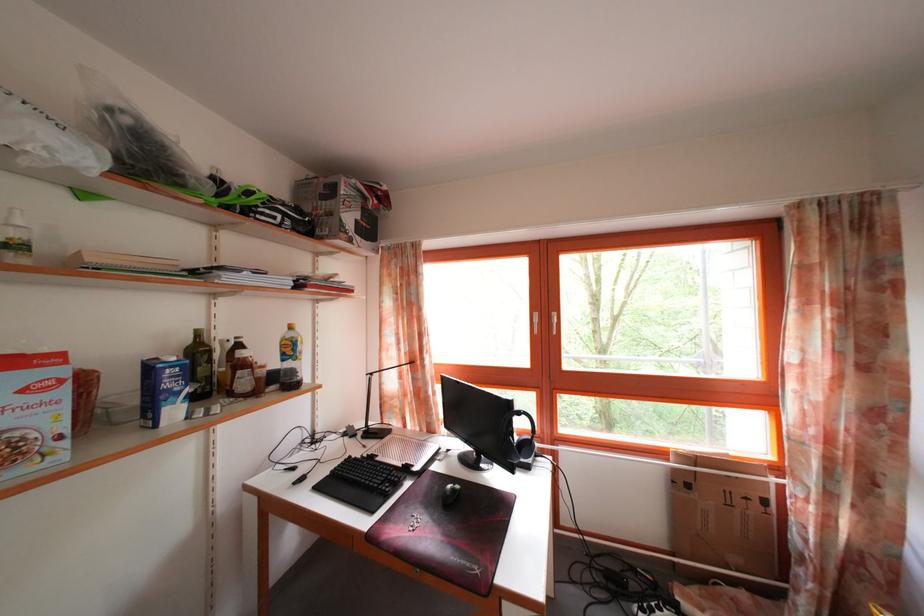
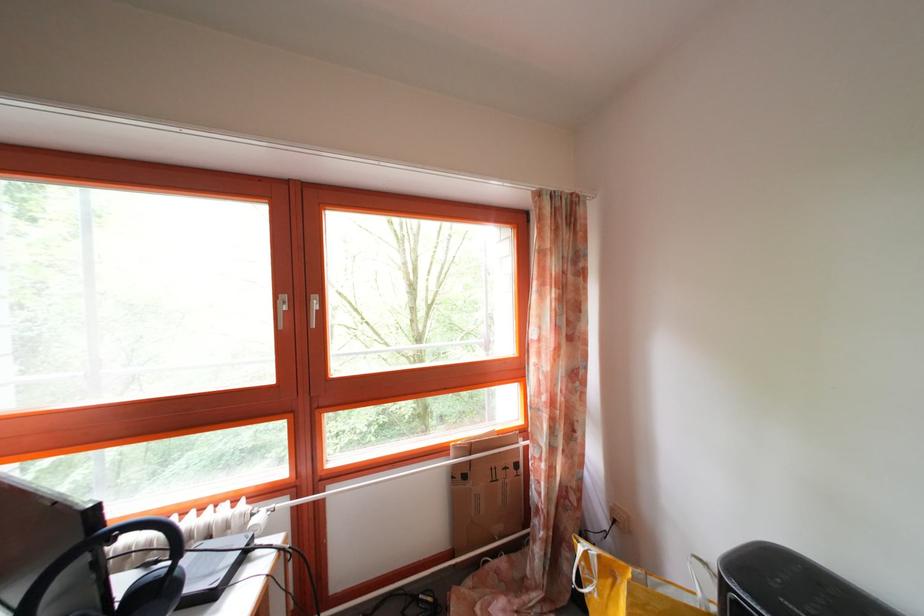
Where in the second image is the point corresponding to point (696, 493) from the first image?

(472, 484)